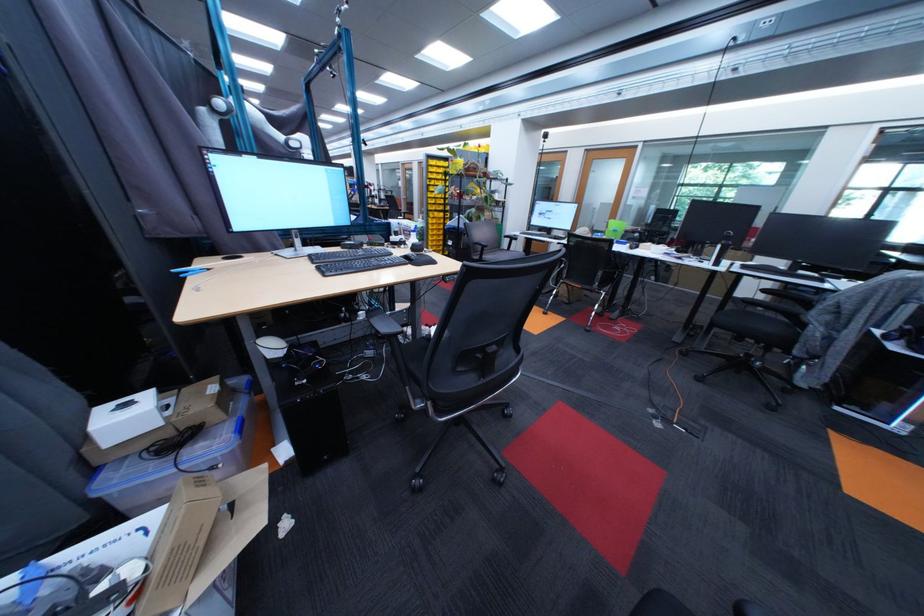
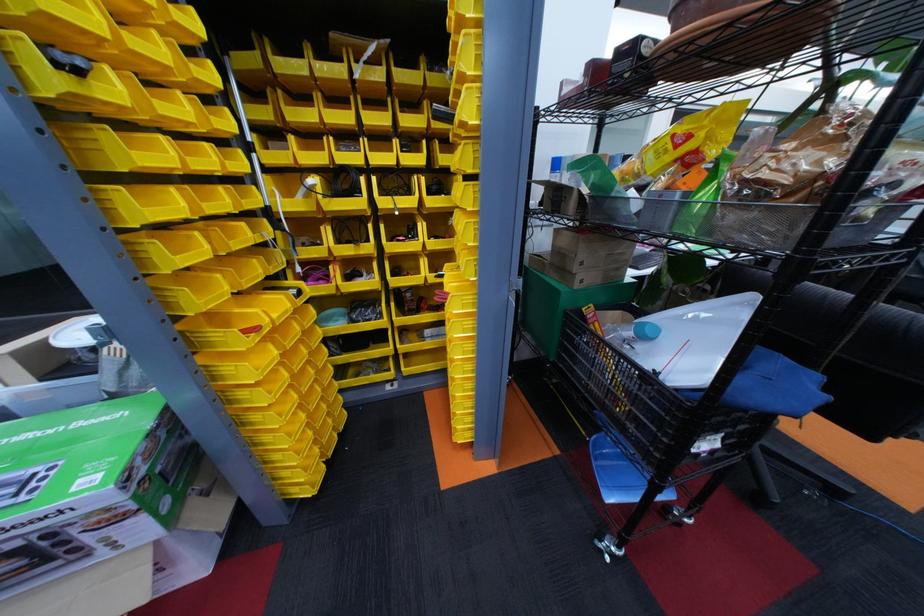
Find the pixel in the second image that matches pixel 444 228 in the first image.

(272, 400)